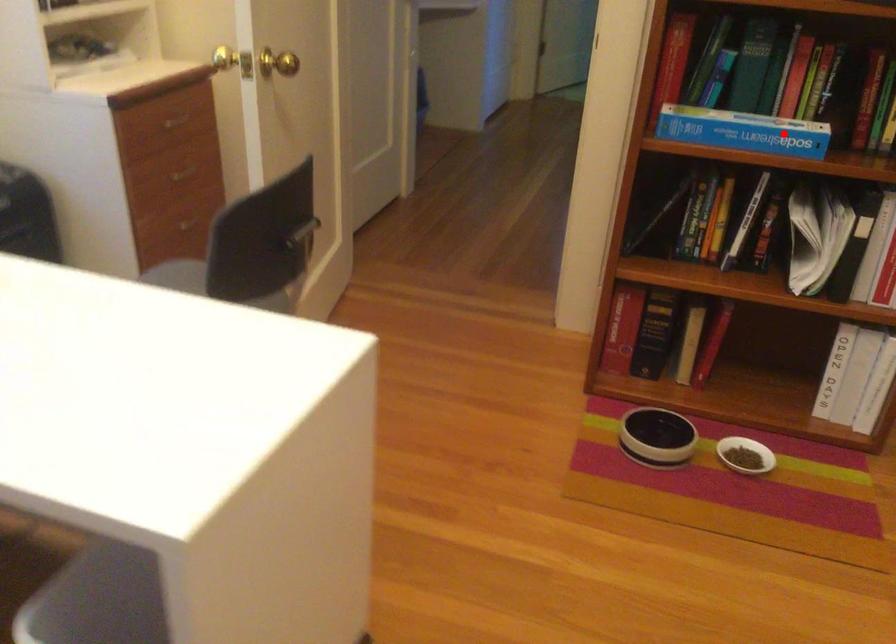
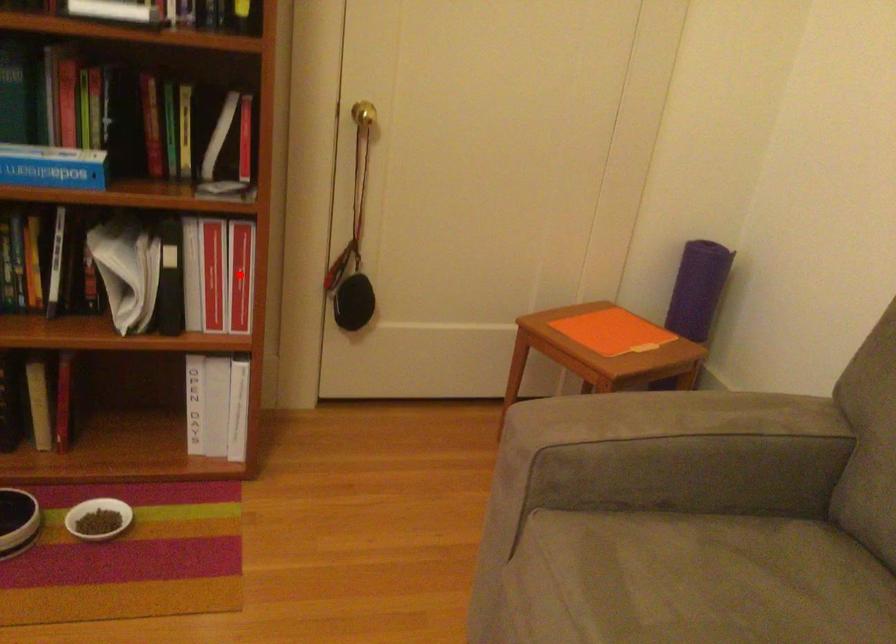
I am providing you with two images of the same scene from different viewpoints. A red point is marked on the first image and another point is marked on the second image. Do the highlighted points in image1 and image2 indicate the same real-world spot?

No